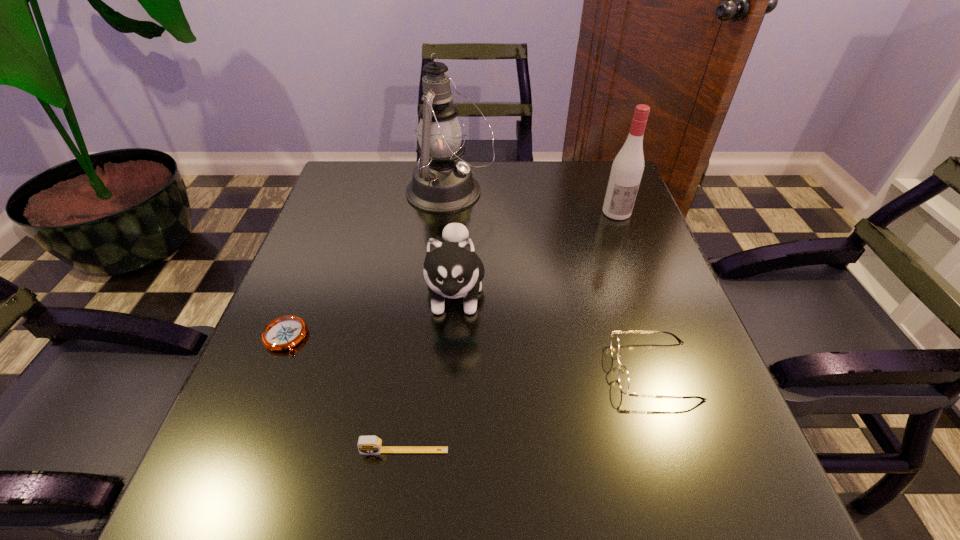
Identify the location of free space located 0.120m at the face of the puppy. The width and height of the screenshot is (960, 540). (449, 392).

Image resolution: width=960 pixels, height=540 pixels. In order to click on vacant space located on the lenses of the spectacles in this screenshot , I will do `click(410, 370)`.

The image size is (960, 540). What are the coordinates of `free spot located 0.390m on the lenses of the spectacles` in the screenshot? It's located at (399, 370).

Find the location of a particular element. free region located on the lenses of the spectacles is located at coordinates (394, 370).

Find the location of a particular element. The image size is (960, 540). vacant space positioned at the front of the second shortest object with the tape extended is located at coordinates (396, 510).

Locate an element on the screen. Image resolution: width=960 pixels, height=540 pixels. free space located 0.070m on the front of the compass is located at coordinates coord(264,389).

Where is `oil lamp located at the far edge`? oil lamp located at the far edge is located at coordinates (442, 183).

I want to click on alcohol that is positioned at the far edge, so click(x=627, y=169).

Where is `object situated at the left edge`? This screenshot has height=540, width=960. object situated at the left edge is located at coordinates (283, 333).

Where is `alcohol that is at the right edge`? alcohol that is at the right edge is located at coordinates (627, 169).